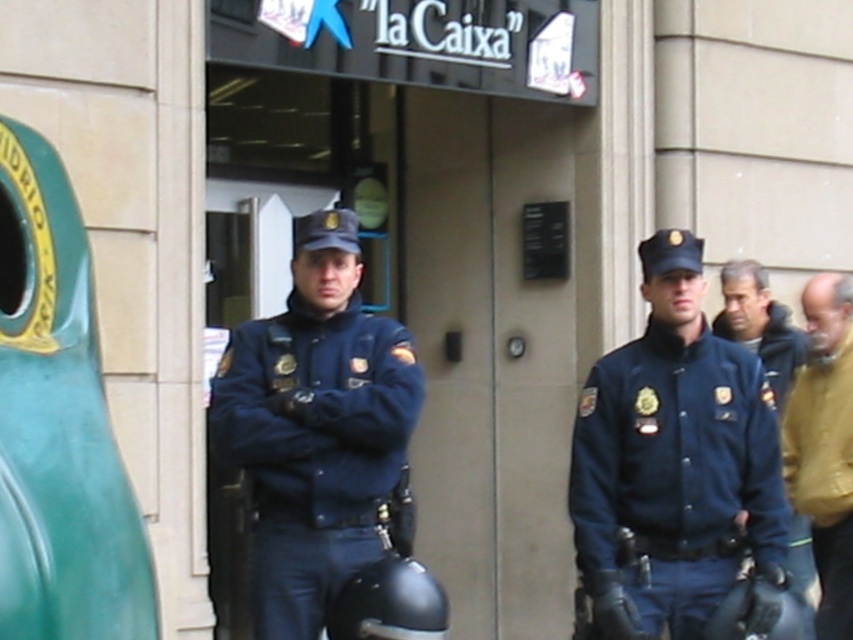
Question: Considering the real-world distances, which object is farthest from the dark blue uniform at center?

Choices:
 (A) brown leather jacket at right
 (B) navy blue uniform at center
 (C) matte blue uniform at center

Answer: (C)

Question: Is navy blue uniform at center to the right of matte blue uniform at center from the viewer's perspective?

Choices:
 (A) no
 (B) yes

Answer: (B)

Question: Which of these objects is positioned closest to the brown leather jacket at right?

Choices:
 (A) navy blue uniform at center
 (B) matte blue uniform at center
 (C) dark blue uniform at center

Answer: (C)

Question: Observing the image, what is the correct spatial positioning of navy blue uniform at center in reference to brown leather jacket at right?

Choices:
 (A) above
 (B) below

Answer: (B)

Question: Can you confirm if brown leather jacket at right is wider than dark blue uniform at center?

Choices:
 (A) yes
 (B) no

Answer: (B)

Question: Which object appears closest to the camera in this image?

Choices:
 (A) matte blue uniform at center
 (B) brown leather jacket at right

Answer: (A)